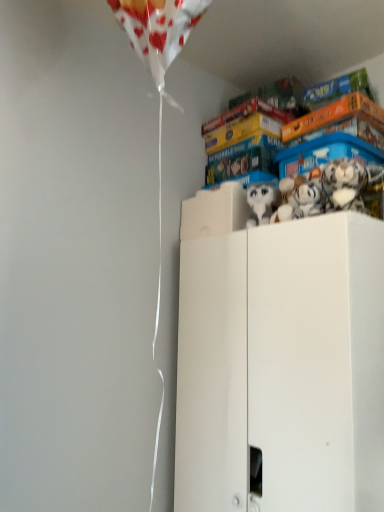
Find the location of a particular element. white matte cabinet at upper right is located at coordinates [x=279, y=359].

What is the approximate height of white plush toy at upper right, the 1th toy when ordered from right to left?

6.13 inches.

Find the location of a particular element. white plush toy at upper center, which appears as the first toy when viewed from the left is located at coordinates (260, 203).

You are a GUI agent. You are given a task and a screenshot of the screen. Output one action in this format:
    pyautogui.click(x=<x>, y=<y>)
    Task: Click on the white matte cabinet at upper right
    
    Given the screenshot: What is the action you would take?
    pyautogui.click(x=279, y=359)

Is white plush toy at upper right, the 1th toy when ordered from right to left, looking in the opposite direction of white matte cabinet at upper right?

That's not correct — white plush toy at upper right, the 1th toy when ordered from right to left, is not looking away from white matte cabinet at upper right.

Based on the photo, from a real-world perspective, who is located higher, white plush toy at upper right, the 1th toy when ordered from right to left, or white matte cabinet at upper right?

white plush toy at upper right, the 1th toy when ordered from right to left, from a real-world perspective.

From the image's perspective, would you say white plush toy at upper right, which is the third toy from left to right, is positioned over white matte cabinet at upper right?

Yes, from the image's perspective, white plush toy at upper right, which is the third toy from left to right, is over white matte cabinet at upper right.

Consider the image. Which point is more forward, (341, 163) or (315, 267)?

→ Point (315, 267)

The image size is (384, 512). Find the location of `the 2nd toy above the white matte cabinet at upper right (from a real-world perspective)`. the 2nd toy above the white matte cabinet at upper right (from a real-world perspective) is located at coordinates (260, 203).

From the image's perspective, which one is positioned lower, white plush toy at upper center, which appears as the first toy when viewed from the left, or white matte cabinet at upper right?

white matte cabinet at upper right appears lower in the image.

How different are the orientations of white plush toy at upper center, which appears as the first toy when viewed from the left, and white matte cabinet at upper right in degrees?

24.2 degrees.

Does white plush toy at upper center, which is the third toy from right to left, have a larger size compared to white matte cabinet at upper right?

No, white plush toy at upper center, which is the third toy from right to left, is not bigger than white matte cabinet at upper right.

Locate an element on the screen. the 2nd toy positioned below the white plush toy at upper right, the 1th toy when ordered from right to left (from the image's perspective) is located at coordinates (298, 199).

Between white plush toy at upper right, the second toy from the right, and white plush toy at upper right, the 1th toy when ordered from right to left, which one has less height?

Standing shorter between the two is white plush toy at upper right, the second toy from the right.

Between white plush toy at upper right, which is the second toy in left-to-right order, and white plush toy at upper right, the 1th toy when ordered from right to left, which one has smaller size?

white plush toy at upper right, which is the second toy in left-to-right order.

Is white matte cabinet at upper right looking in the opposite direction of white plush toy at upper center, which is the third toy from right to left?

white matte cabinet at upper right is not turned away from white plush toy at upper center, which is the third toy from right to left.

Are white matte cabinet at upper right and white plush toy at upper center, which appears as the first toy when viewed from the left, beside each other?

white matte cabinet at upper right and white plush toy at upper center, which appears as the first toy when viewed from the left, are clearly separated.

From the image's perspective, which object appears higher, white matte cabinet at upper right or white plush toy at upper center, which is the third toy from right to left?

white plush toy at upper center, which is the third toy from right to left, from the image's perspective.

Where is `cabinetry below the white plush toy at upper center, which appears as the first toy when viewed from the left (from a real-world perspective)`? This screenshot has height=512, width=384. cabinetry below the white plush toy at upper center, which appears as the first toy when viewed from the left (from a real-world perspective) is located at coordinates (279, 359).

Can you confirm if white plush toy at upper right, which is the third toy from left to right, is bigger than white plush toy at upper center, which is the third toy from right to left?

Indeed, white plush toy at upper right, which is the third toy from left to right, has a larger size compared to white plush toy at upper center, which is the third toy from right to left.

What's the angular difference between white plush toy at upper right, which is the third toy from left to right, and white plush toy at upper center, which appears as the first toy when viewed from the left,'s facing directions?

The facing directions of white plush toy at upper right, which is the third toy from left to right, and white plush toy at upper center, which appears as the first toy when viewed from the left, are 25.7 degrees apart.

Is white plush toy at upper right, the 1th toy when ordered from right to left, at the left side of white plush toy at upper center, which is the third toy from right to left?

No.

Between white plush toy at upper right, which is the third toy from left to right, and white plush toy at upper center, which is the third toy from right to left, which one is positioned behind?

white plush toy at upper center, which is the third toy from right to left, is further from the camera.

From the image's perspective, who appears lower, white plush toy at upper center, which is the third toy from right to left, or white plush toy at upper right, which is the third toy from left to right?

From the image's view, white plush toy at upper center, which is the third toy from right to left, is below.

In terms of height, does white plush toy at upper center, which is the third toy from right to left, look taller or shorter compared to white plush toy at upper right, which is the third toy from left to right?

Considering their sizes, white plush toy at upper center, which is the third toy from right to left, has more height than white plush toy at upper right, which is the third toy from left to right.

Can you tell me how much white plush toy at upper center, which appears as the first toy when viewed from the left, and white plush toy at upper right, which is the third toy from left to right, differ in facing direction?

white plush toy at upper center, which appears as the first toy when viewed from the left, and white plush toy at upper right, which is the third toy from left to right, are facing 25.7 degrees away from each other.

Is white plush toy at upper center, which is the third toy from right to left, wider or thinner than white plush toy at upper right, which is the third toy from left to right?

white plush toy at upper center, which is the third toy from right to left, is thinner than white plush toy at upper right, which is the third toy from left to right.

Considering the sizes of objects white matte cabinet at upper right and white plush toy at upper right, which is the third toy from left to right, in the image provided, who is smaller, white matte cabinet at upper right or white plush toy at upper right, which is the third toy from left to right,?

white plush toy at upper right, which is the third toy from left to right, is smaller.

Which of these two, white matte cabinet at upper right or white plush toy at upper right, the 1th toy when ordered from right to left, stands taller?

Standing taller between the two is white matte cabinet at upper right.

Can you confirm if white matte cabinet at upper right is wider than white plush toy at upper right, which is the third toy from left to right?

Yes.

The image size is (384, 512). I want to click on toy that is on the right side of white matte cabinet at upper right, so click(x=344, y=185).

You are a GUI agent. You are given a task and a screenshot of the screen. Output one action in this format:
    pyautogui.click(x=<x>, y=<y>)
    Task: Click on the 2nd toy above the white matte cabinet at upper right (from the image's perspective)
    
    Given the screenshot: What is the action you would take?
    pyautogui.click(x=260, y=203)

Looking at this image, based on their spatial positions, is white matte cabinet at upper right or white plush toy at upper right, which is the second toy in left-to-right order, further from white plush toy at upper center, which appears as the first toy when viewed from the left?

The object further to white plush toy at upper center, which appears as the first toy when viewed from the left, is white matte cabinet at upper right.

Looking at the image, which one is located further to white plush toy at upper right, the second toy from the right, white plush toy at upper center, which is the third toy from right to left, or white matte cabinet at upper right?

The object further to white plush toy at upper right, the second toy from the right, is white matte cabinet at upper right.

Estimate the real-world distances between objects in this image. Which object is closer to white plush toy at upper right, which is the second toy in left-to-right order, white plush toy at upper center, which appears as the first toy when viewed from the left, or white plush toy at upper right, which is the third toy from left to right?

Among the two, white plush toy at upper right, which is the third toy from left to right, is located nearer to white plush toy at upper right, which is the second toy in left-to-right order.

Based on their spatial positions, is white plush toy at upper right, which is the second toy in left-to-right order, or white plush toy at upper center, which is the third toy from right to left, closer to white matte cabinet at upper right?

white plush toy at upper right, which is the second toy in left-to-right order, lies closer to white matte cabinet at upper right than the other object.

Considering their positions, is white matte cabinet at upper right positioned closer to white plush toy at upper right, which is the third toy from left to right, than white plush toy at upper right, which is the second toy in left-to-right order?

white plush toy at upper right, which is the second toy in left-to-right order, is positioned closer to the anchor white plush toy at upper right, which is the third toy from left to right.

From the picture: From the image, which object appears to be nearer to white matte cabinet at upper right, white plush toy at upper right, the second toy from the right, or white plush toy at upper right, the 1th toy when ordered from right to left?

white plush toy at upper right, the second toy from the right.

When comparing their distances from white plush toy at upper right, the 1th toy when ordered from right to left, does white plush toy at upper right, which is the second toy in left-to-right order, or white matte cabinet at upper right seem further?

Among the two, white matte cabinet at upper right is located further to white plush toy at upper right, the 1th toy when ordered from right to left.

Estimate the real-world distances between objects in this image. Which object is closer to white plush toy at upper center, which appears as the first toy when viewed from the left, white plush toy at upper right, which is the third toy from left to right, or white matte cabinet at upper right?

Among the two, white plush toy at upper right, which is the third toy from left to right, is located nearer to white plush toy at upper center, which appears as the first toy when viewed from the left.

This screenshot has width=384, height=512. In order to click on toy that lies between white plush toy at upper center, which is the third toy from right to left, and white matte cabinet at upper right from top to bottom in this screenshot , I will do `click(298, 199)`.

Locate an element on the screen. This screenshot has width=384, height=512. toy between white plush toy at upper center, which is the third toy from right to left, and white plush toy at upper right, the 1th toy when ordered from right to left is located at coordinates (298, 199).